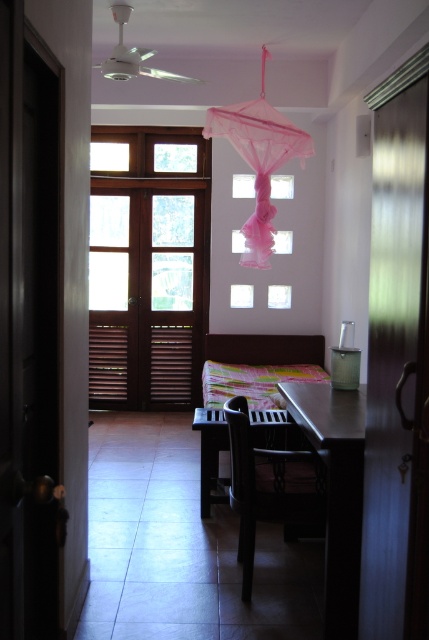
You are planning to place a new decorative item on the metallic dark brown table at center. Considering the table and the pink tulle umbrella at upper center, which object is narrower in width?

The metallic dark brown table at center is thinner than the pink tulle umbrella at upper center, so the metallic dark brown table at center is narrower in width.

You are standing at the doorway and want to sit down. The black matte chair at center and dark brown wooden table at center are in your view. Which object is closer to you?

The black matte chair at center is closer to you because it is below the dark brown wooden table at center, indicating it is positioned lower and nearer in the scene.

You are standing at the doorway and see the pink tulle umbrella at upper center and the dark brown wooden table at center. Which object is positioned to the right of the other?

The pink tulle umbrella at upper center is to the right of the dark brown wooden table at center.